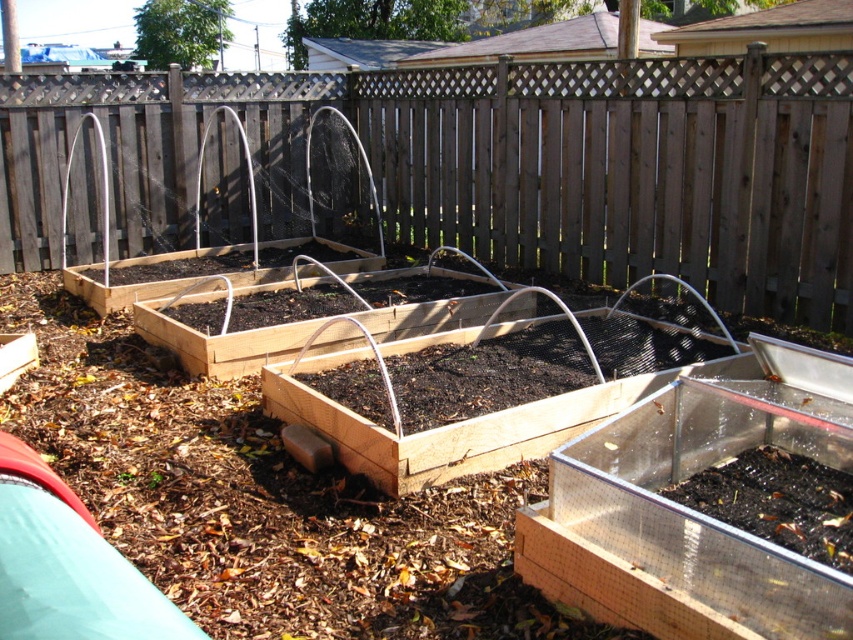
Measure the distance from brown wooden fence at upper center to brown wooden raised bed at center.

brown wooden fence at upper center is 15.77 feet from brown wooden raised bed at center.

Is brown wooden fence at upper center positioned in front of brown wooden raised bed at center?

No, it is not.

Is point (521, 225) closer to camera compared to point (183, 605)?

No, it is behind (183, 605).

Locate an element on the screen. This screenshot has height=640, width=853. brown wooden fence at upper center is located at coordinates (492, 164).